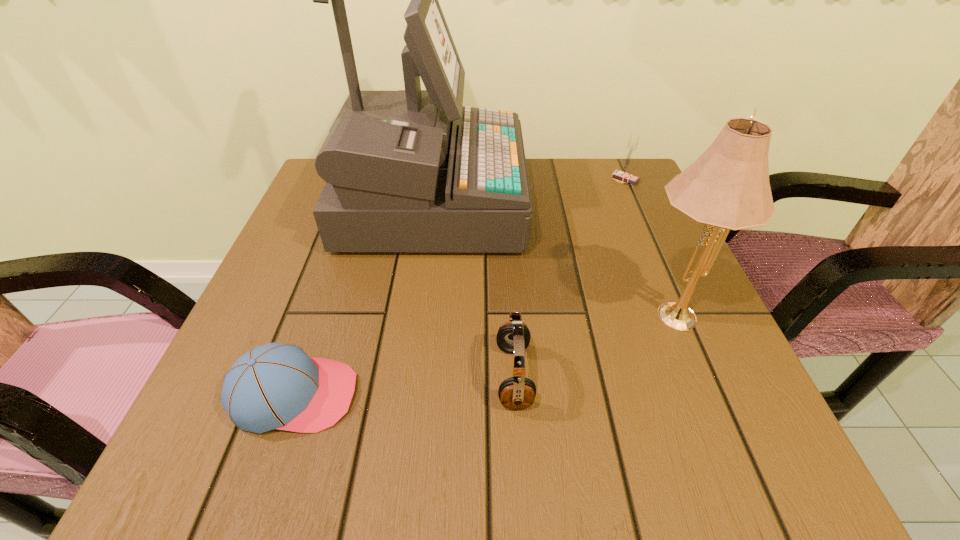
Find the location of a particular element. vacant position located 0.120m on the ear cups of the headset is located at coordinates (422, 376).

Where is `blank space located 0.060m on the front-facing side of the shortest object`? blank space located 0.060m on the front-facing side of the shortest object is located at coordinates (395, 395).

The height and width of the screenshot is (540, 960). In order to click on cash register located at the far edge in this screenshot , I will do `click(412, 170)`.

The height and width of the screenshot is (540, 960). I want to click on matchbox that is at the far edge, so click(x=623, y=174).

The image size is (960, 540). Find the location of `object present at the near edge`. object present at the near edge is located at coordinates (278, 386).

Find the location of a particular element. The image size is (960, 540). cash register situated at the left edge is located at coordinates (412, 170).

Find the location of a particular element. This screenshot has height=540, width=960. baseball cap located at the left edge is located at coordinates (278, 386).

Where is `lampshade that is at the right edge`? lampshade that is at the right edge is located at coordinates (728, 187).

The image size is (960, 540). I want to click on matchbox that is at the right edge, so click(623, 174).

This screenshot has height=540, width=960. In order to click on object that is at the far left corner in this screenshot , I will do `click(412, 170)`.